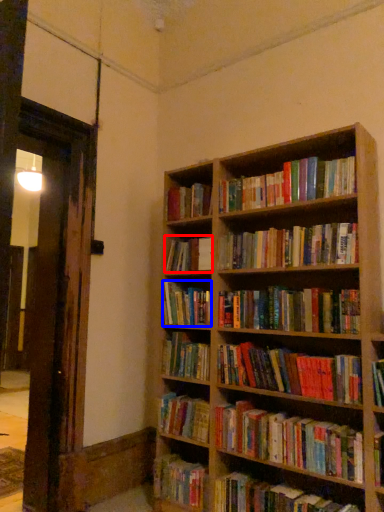
Question: Among these objects, which one is farthest to the camera, book (highlighted by a red box) or book (highlighted by a blue box)?

Choices:
 (A) book
 (B) book

Answer: (A)